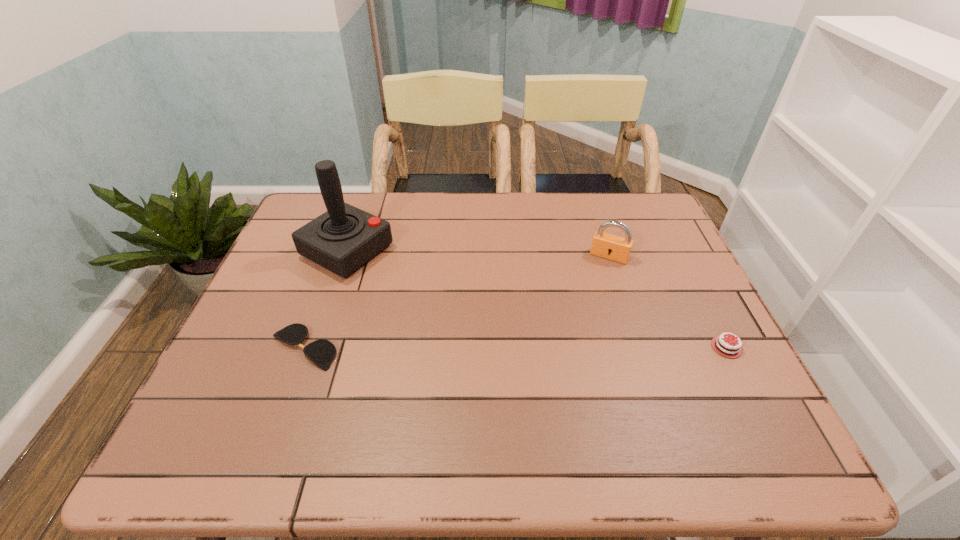
At what (x,y) coordinates should I click in order to perform the action: click on vacant point that satisfies the following two spatial constraints: 1. on the back side of the spectacles; 2. on the left side of the second shortest object. Please return your answer as a coordinate pair (x, y). This screenshot has height=540, width=960. Looking at the image, I should click on (303, 347).